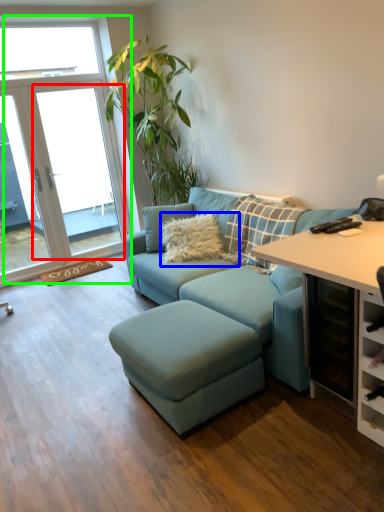
Question: Based on their relative distances, which object is farther from window screen (highlighted by a red box)? Choose from pillow (highlighted by a blue box) and window (highlighted by a green box).

Choices:
 (A) pillow
 (B) window

Answer: (A)